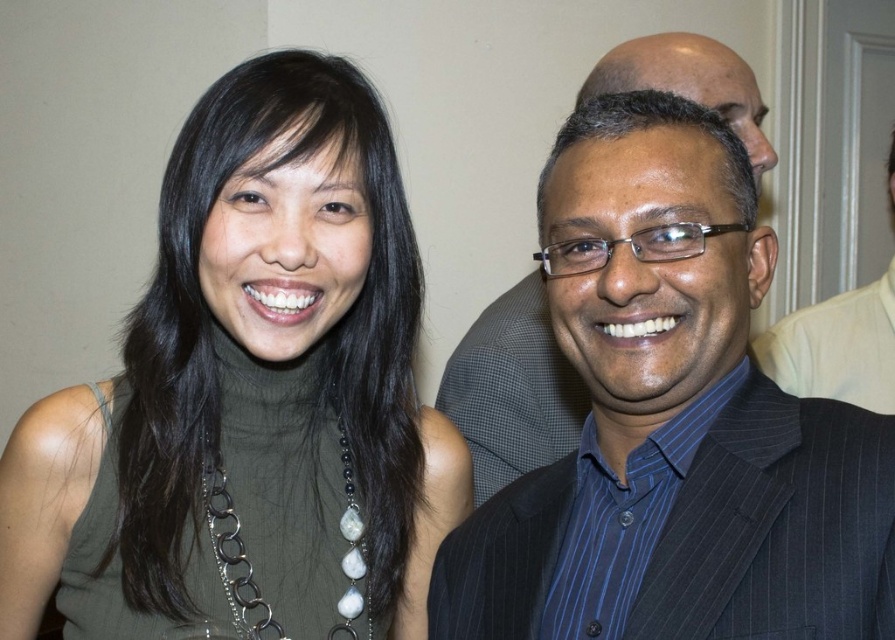
Is point (223, 374) in front of point (888, 280)?

That is True.

Which is more to the left, green matte turtleneck at upper left or matte black suit at right?

green matte turtleneck at upper left is more to the left.

Is point (351, 129) closer to viewer compared to point (857, 401)?

Yes, point (351, 129) is in front of point (857, 401).

In order to click on green matte turtleneck at upper left in this screenshot , I will do `click(249, 397)`.

Which is above, black pinstripe suit at center or silver metallic chain with beads at center?

black pinstripe suit at center is above.

Is point (484, 428) more distant than point (254, 628)?

That is True.

Locate an element on the screen. black pinstripe suit at center is located at coordinates (512, 388).

Does black pinstripe suit at center come behind matte black suit at right?

No, black pinstripe suit at center is in front of matte black suit at right.

Is black pinstripe suit at center to the right of matte black suit at right from the viewer's perspective?

In fact, black pinstripe suit at center is to the left of matte black suit at right.

The image size is (895, 640). I want to click on black pinstripe suit at center, so click(512, 388).

The image size is (895, 640). Find the location of `black pinstripe suit at center`. black pinstripe suit at center is located at coordinates (512, 388).